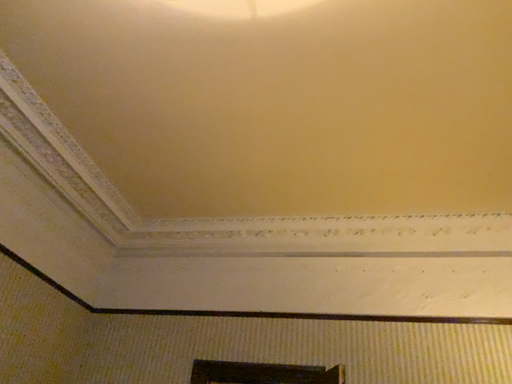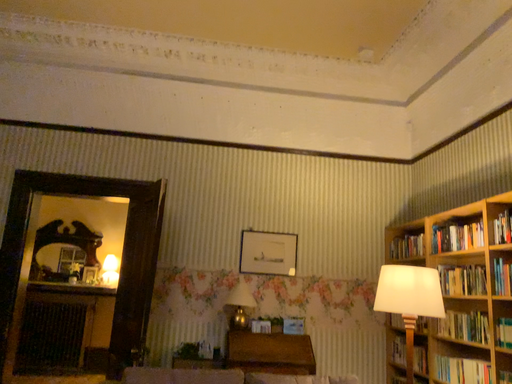
Question: Which way did the camera rotate in the video?

Choices:
 (A) rotated upward
 (B) rotated downward

Answer: (B)